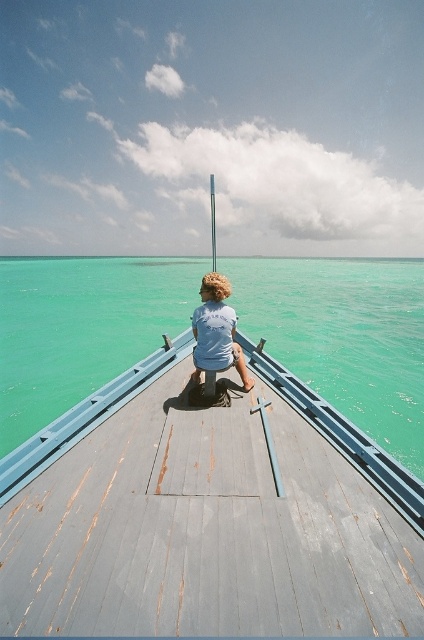
Which of these two, rusty wood dock at center or light blue fabric shirt at center, stands taller?

With more height is light blue fabric shirt at center.

Can you confirm if rusty wood dock at center is shorter than light blue fabric shirt at center?

Yes, rusty wood dock at center is shorter than light blue fabric shirt at center.

Is point (21, 577) positioned in front of point (214, 326)?

Yes, point (21, 577) is closer to viewer.

Where is `rusty wood dock at center`? The image size is (424, 640). rusty wood dock at center is located at coordinates (208, 515).

Does teal glossy water at center come in front of light blue fabric shirt at center?

No, it is not.

This screenshot has height=640, width=424. What do you see at coordinates (345, 337) in the screenshot?
I see `teal glossy water at center` at bounding box center [345, 337].

Between point (42, 324) and point (220, 362), which one is positioned behind?

Point (42, 324)

Locate an element on the screen. The width and height of the screenshot is (424, 640). teal glossy water at center is located at coordinates (345, 337).

Measure the distance from rusty wood dock at center to teal glossy water at center.

rusty wood dock at center and teal glossy water at center are 17.17 meters apart from each other.

Can you confirm if rusty wood dock at center is smaller than teal glossy water at center?

Yes.

Is point (159, 497) positioned in front of point (353, 269)?

Yes, point (159, 497) is closer to viewer.

Identify the location of rusty wood dock at center. (208, 515).